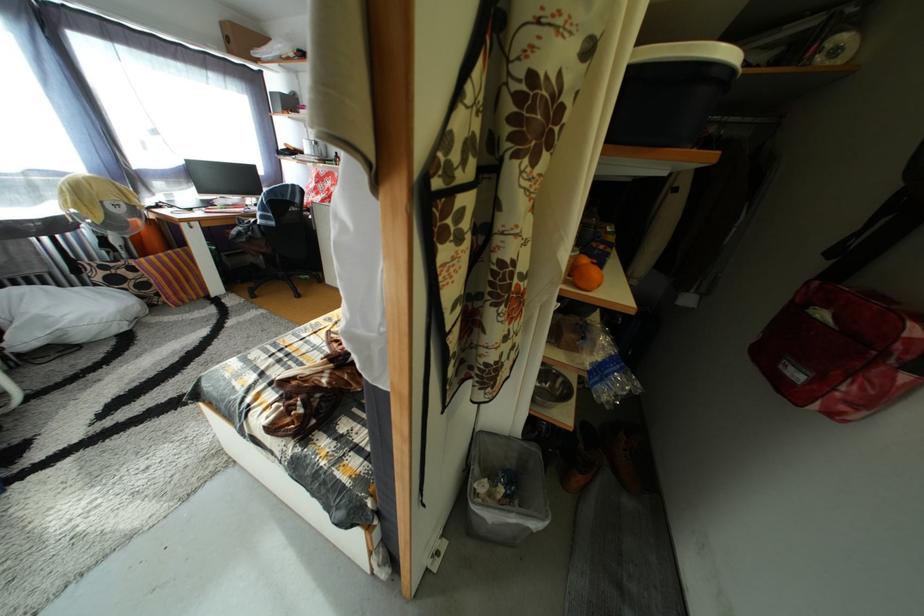
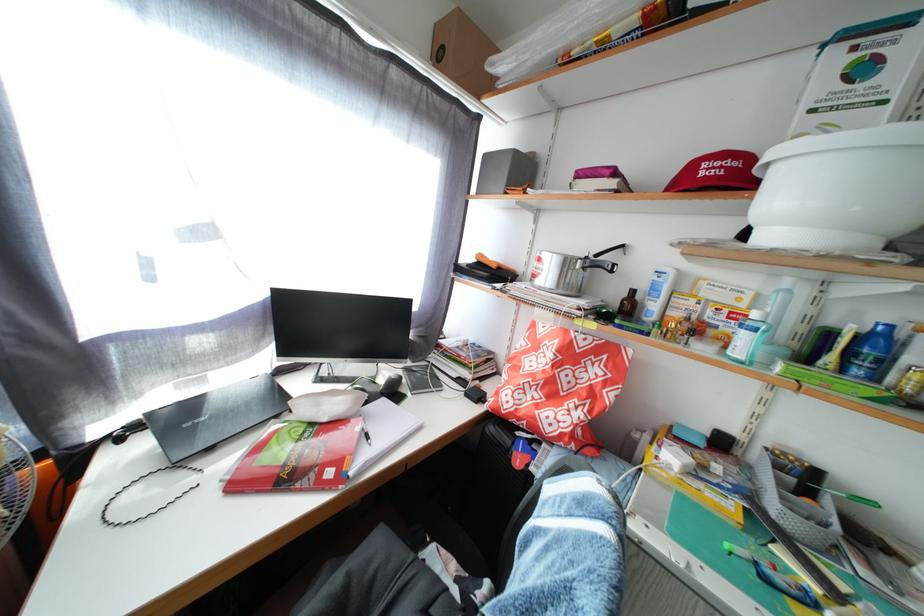
Where in the second image is the point corresponding to pixel 331 179 from the first image?

(590, 350)